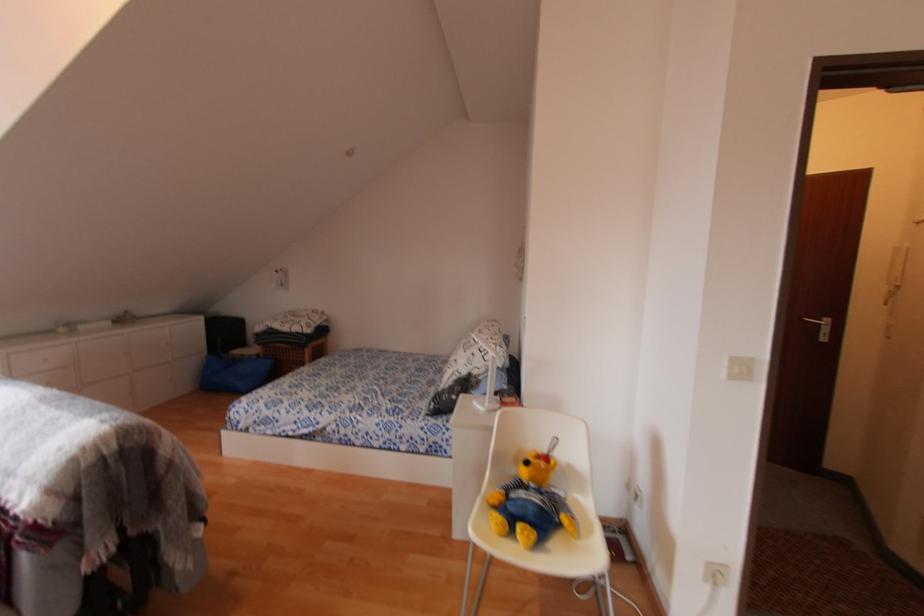
The height and width of the screenshot is (616, 924). What are the coordinates of `white light switch` in the screenshot? It's located at (742, 369).